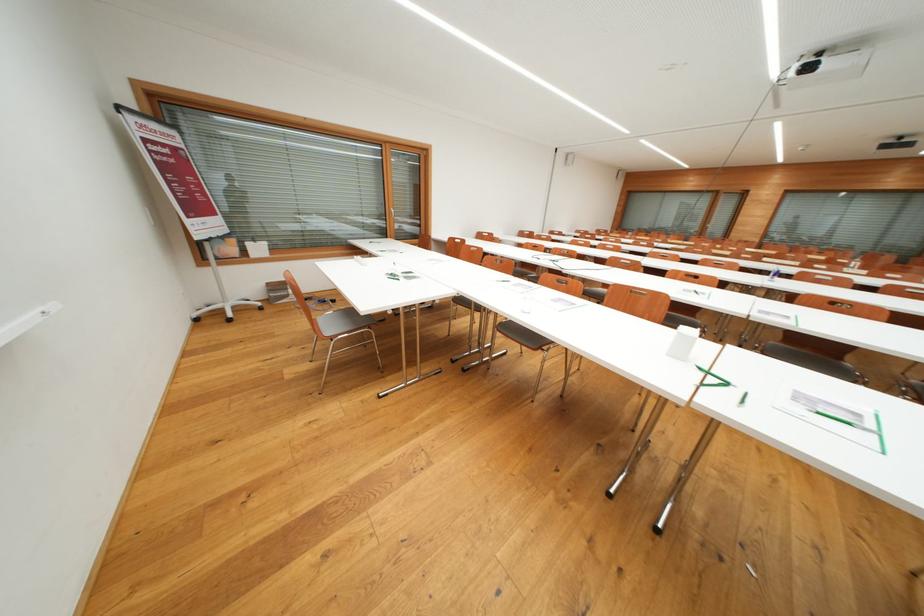
Find where to roll the white stand wheel. Please return your answer as a coordinate pair (x, y).

(224, 309)